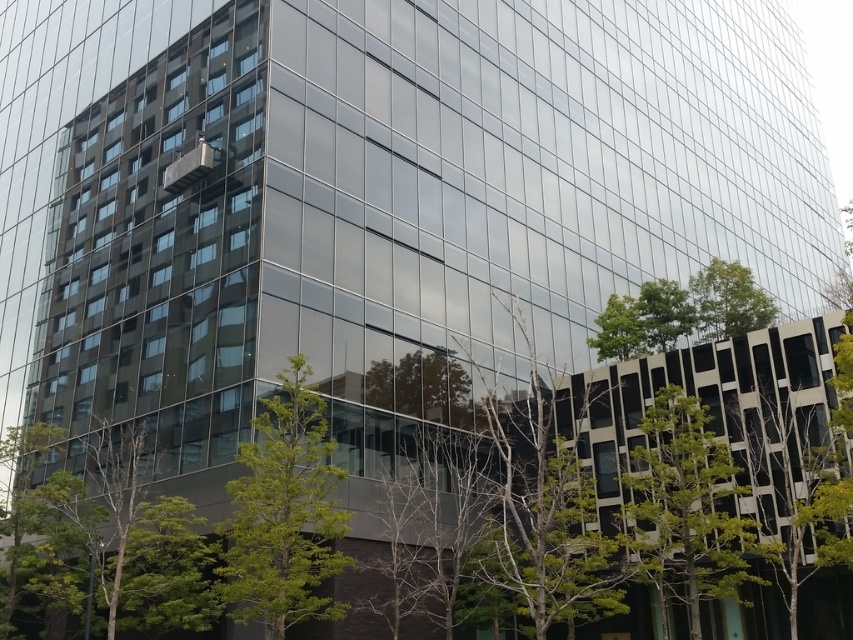
Can you confirm if green leafy tree at center is thinner than green leafy tree at lower right?

Yes.

In the scene shown: Which is below, green leafy tree at center or green leafy tree at lower right?

Positioned lower is green leafy tree at lower right.

Where is `green leafy tree at center`? Image resolution: width=853 pixels, height=640 pixels. green leafy tree at center is located at coordinates (283, 513).